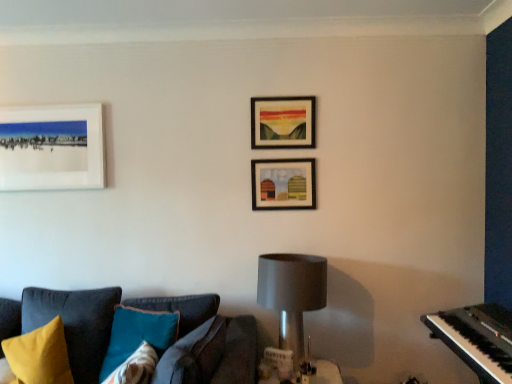
Question: From a real-world perspective, is black plastic piano at right below wooden frame at upper center, arranged as the second picture frame when viewed from the right?

Choices:
 (A) no
 (B) yes

Answer: (B)

Question: Considering the relative sizes of black plastic piano at right and wooden frame at upper center, arranged as the second picture frame when viewed from the right, in the image provided, is black plastic piano at right wider than wooden frame at upper center, arranged as the second picture frame when viewed from the right,?

Choices:
 (A) no
 (B) yes

Answer: (B)

Question: Is black plastic piano at right positioned behind wooden frame at upper center, positioned as the second picture frame in left-to-right order?

Choices:
 (A) yes
 (B) no

Answer: (B)

Question: From the image's perspective, is black plastic piano at right beneath wooden frame at upper center, positioned as the second picture frame in left-to-right order?

Choices:
 (A) yes
 (B) no

Answer: (A)

Question: Does black plastic piano at right appear on the left side of wooden frame at upper center, arranged as the second picture frame when viewed from the right?

Choices:
 (A) yes
 (B) no

Answer: (B)

Question: Looking at their shapes, would you say black plastic piano at right is wider or thinner than white matte picture frame at upper left, the 3th picture frame viewed from the right?

Choices:
 (A) wide
 (B) thin

Answer: (A)

Question: Is black plastic piano at right in front of or behind white matte picture frame at upper left, the 3th picture frame viewed from the right, in the image?

Choices:
 (A) front
 (B) behind

Answer: (A)

Question: Which is correct: black plastic piano at right is inside white matte picture frame at upper left, the 1th picture frame in the left-to-right sequence, or outside of it?

Choices:
 (A) outside
 (B) inside

Answer: (A)

Question: Based on their sizes in the image, would you say black plastic piano at right is bigger or smaller than white matte picture frame at upper left, the 3th picture frame viewed from the right?

Choices:
 (A) small
 (B) big

Answer: (A)

Question: Is black plastic piano at right spatially inside yellow fabric pillow at lower left, marked as the 1th pillow in a left-to-right arrangement, or outside of it?

Choices:
 (A) inside
 (B) outside

Answer: (B)

Question: From a real-world perspective, relative to yellow fabric pillow at lower left, marked as the 1th pillow in a left-to-right arrangement, is black plastic piano at right vertically above or below?

Choices:
 (A) below
 (B) above

Answer: (B)

Question: Would you say black plastic piano at right is to the left or to the right of yellow fabric pillow at lower left, the second pillow when ordered from right to left, in the picture?

Choices:
 (A) left
 (B) right

Answer: (B)

Question: Looking at the image, does black plastic piano at right seem bigger or smaller compared to yellow fabric pillow at lower left, marked as the 1th pillow in a left-to-right arrangement?

Choices:
 (A) big
 (B) small

Answer: (B)

Question: From a real-world perspective, is teal velvet pillow at lower left, the 2th pillow from the left, physically located above or below wooden frame at upper center, arranged as the second picture frame when viewed from the right?

Choices:
 (A) below
 (B) above

Answer: (A)

Question: From the image's perspective, is teal velvet pillow at lower left, the 2th pillow from the left, above or below wooden frame at upper center, arranged as the second picture frame when viewed from the right?

Choices:
 (A) above
 (B) below

Answer: (B)